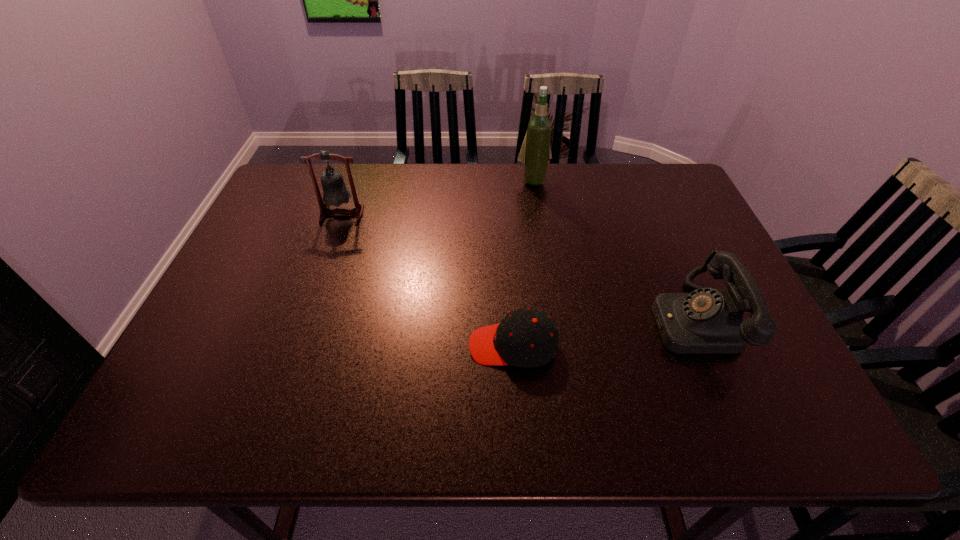
Where is `free space located 0.200m on the dial of the telephone`? free space located 0.200m on the dial of the telephone is located at coordinates (567, 320).

At what (x,y) coordinates should I click in order to perform the action: click on free location located 0.370m on the dial of the telephone. Please return your answer as a coordinate pair (x, y). Image resolution: width=960 pixels, height=540 pixels. Looking at the image, I should click on (493, 320).

I want to click on vacant space located on the front-facing side of the shortest object, so click(405, 346).

I want to click on vacant area situated 0.170m on the front-facing side of the shortest object, so click(392, 346).

The width and height of the screenshot is (960, 540). In order to click on vacant space situated on the front-facing side of the shortest object in this screenshot , I will do `click(437, 346)`.

Find the location of a particular element. The image size is (960, 540). wine bottle at the far edge is located at coordinates (535, 152).

In order to click on bell that is at the far edge in this screenshot , I will do `click(335, 193)`.

At what (x,y) coordinates should I click in order to perform the action: click on object that is at the right edge. Please return your answer as a coordinate pair (x, y). The width and height of the screenshot is (960, 540). Looking at the image, I should click on (706, 321).

Locate an element on the screen. The width and height of the screenshot is (960, 540). vacant area at the far edge of the desktop is located at coordinates (596, 191).

In the image, there is a desktop. In order to click on vacant space at the near edge in this screenshot , I will do `click(532, 426)`.